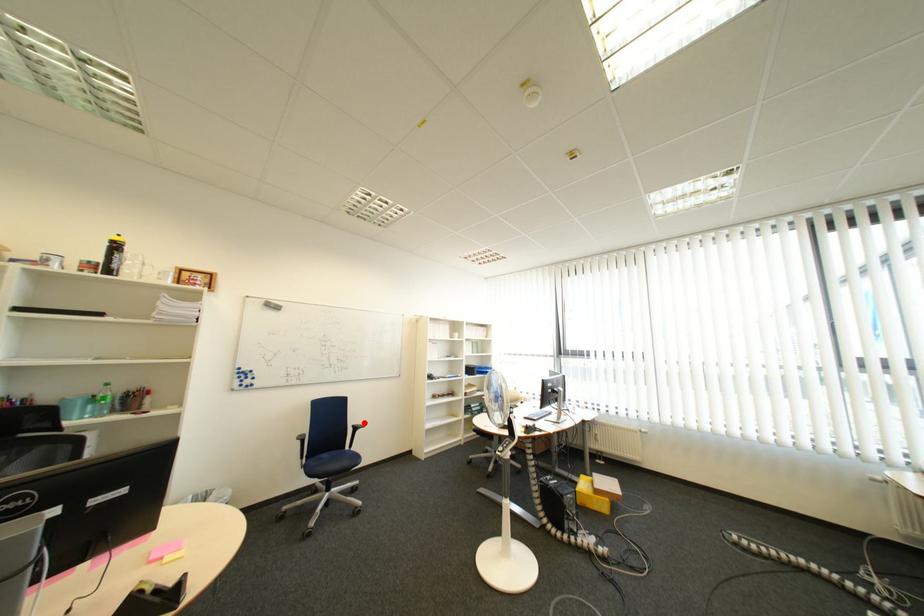
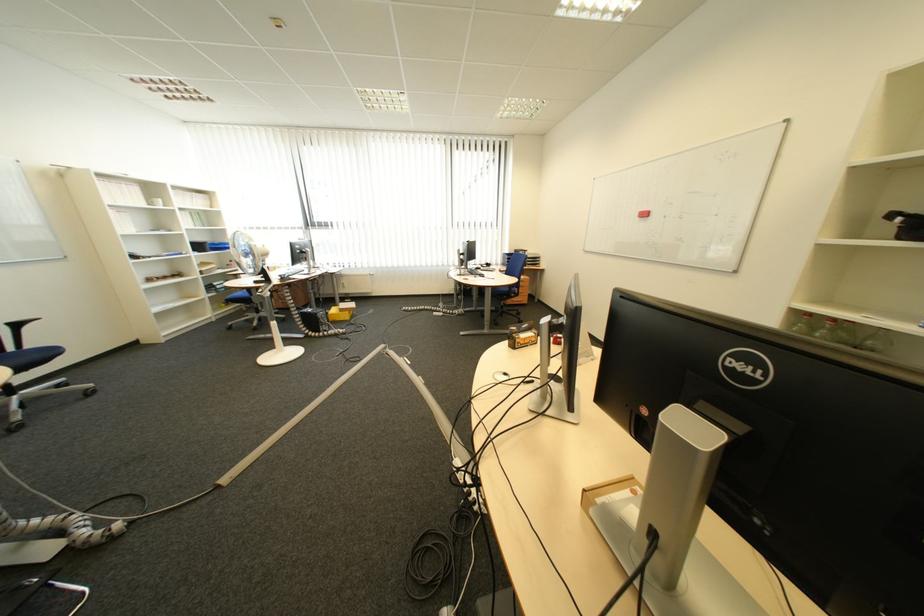
In the second image, find the point that corresponds to the highlighted location in the first image.

(13, 321)